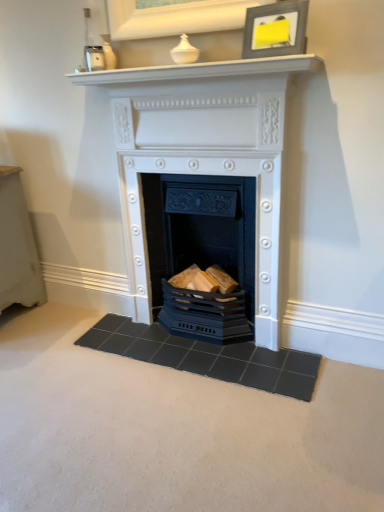
Question: In terms of width, does white glossy mantle at upper center look wider or thinner when compared to matte black picture frame at upper center?

Choices:
 (A) thin
 (B) wide

Answer: (B)

Question: From a real-world perspective, is white glossy mantle at upper center above or below matte black picture frame at upper center?

Choices:
 (A) above
 (B) below

Answer: (B)

Question: Estimate the real-world distances between objects in this image. Which object is closer to the matte black picture frame at upper center?

Choices:
 (A) matte black fireplace at center, the 2th fireplace from the top
 (B) white glossy mantle at upper center
 (C) white matte fireplace at center, marked as the 1th fireplace in a top-to-bottom arrangement
 (D) dark gray tile doormat at center

Answer: (B)

Question: Considering the real-world distances, which object is closest to the matte black fireplace at center, placed as the 1th fireplace when sorted from bottom to top?

Choices:
 (A) matte black picture frame at upper center
 (B) white matte fireplace at center, marked as the 1th fireplace in a top-to-bottom arrangement
 (C) white glossy mantle at upper center
 (D) dark gray tile doormat at center

Answer: (B)